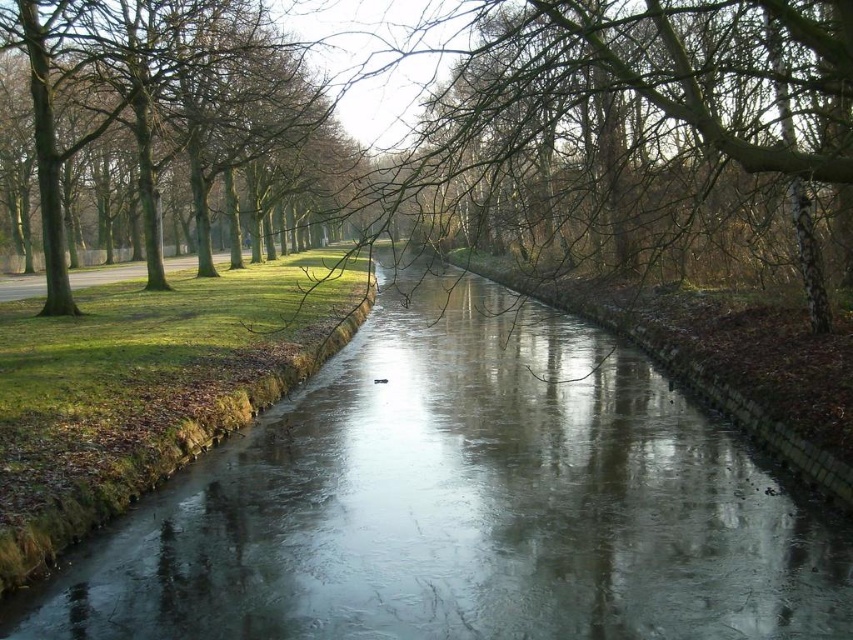
Question: Which point appears closest to the camera in this image?

Choices:
 (A) (515, 36)
 (B) (99, 548)

Answer: (B)

Question: Which object is the closest to the icy smooth river at center?

Choices:
 (A) brown/dry bark tree at center
 (B) green leafy tree at upper left

Answer: (A)

Question: Where is brown/dry bark tree at center located in relation to green leafy tree at upper left in the image?

Choices:
 (A) left
 (B) right

Answer: (B)

Question: Which of the following is the closest to the observer?

Choices:
 (A) (701, 13)
 (B) (555, 628)

Answer: (B)

Question: Is icy smooth river at center above green leafy tree at upper left?

Choices:
 (A) no
 (B) yes

Answer: (A)

Question: Is brown/dry bark tree at center bigger than green leafy tree at upper left?

Choices:
 (A) yes
 (B) no

Answer: (B)